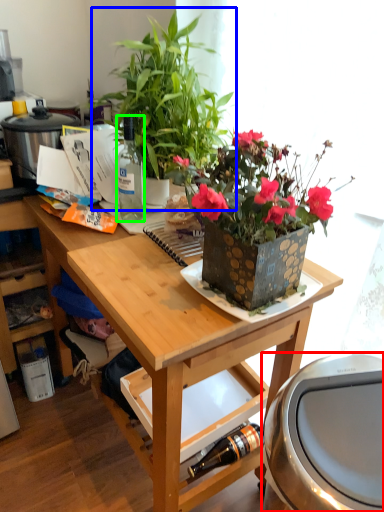
Question: Estimate the real-world distances between objects in this image. Which object is closer to appliance (highlighted by a red box), houseplant (highlighted by a blue box) or bottle (highlighted by a green box)?

Choices:
 (A) houseplant
 (B) bottle

Answer: (A)